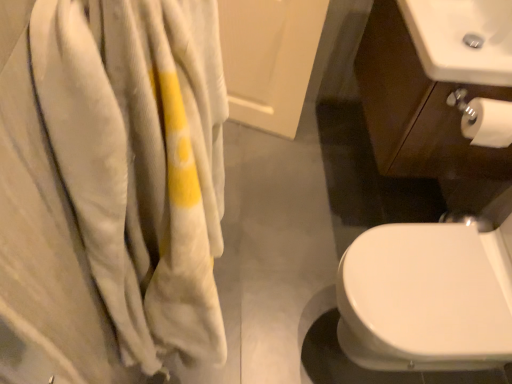
Question: Considering the relative sizes of soft white towel at left and white glossy sink at lower right, the 1th sink when ordered from front to back, in the image provided, is soft white towel at left bigger than white glossy sink at lower right, the 1th sink when ordered from front to back,?

Choices:
 (A) no
 (B) yes

Answer: (A)

Question: Does soft white towel at left contain white glossy sink at lower right, which appears as the 2th sink when viewed from the back?

Choices:
 (A) yes
 (B) no

Answer: (B)

Question: Is soft white towel at left at the left side of white glossy sink at lower right, the 2th sink when ordered from top to bottom?

Choices:
 (A) yes
 (B) no

Answer: (A)

Question: Considering the relative sizes of soft white towel at left and white glossy sink at lower right, the 1th sink when ordered from front to back, in the image provided, is soft white towel at left taller than white glossy sink at lower right, the 1th sink when ordered from front to back,?

Choices:
 (A) no
 (B) yes

Answer: (B)

Question: From a real-world perspective, does soft white towel at left stand above white glossy sink at lower right, the 2th sink when ordered from top to bottom?

Choices:
 (A) yes
 (B) no

Answer: (A)

Question: Is soft white towel at left thinner than white glossy sink at lower right, the 2th sink when ordered from top to bottom?

Choices:
 (A) no
 (B) yes

Answer: (B)

Question: Does soft white towel at left come in front of white matte toilet paper at lower right?

Choices:
 (A) no
 (B) yes

Answer: (B)

Question: Can you confirm if soft white towel at left is positioned to the left of white matte toilet paper at lower right?

Choices:
 (A) yes
 (B) no

Answer: (A)

Question: Does soft white towel at left have a lesser height compared to white matte toilet paper at lower right?

Choices:
 (A) no
 (B) yes

Answer: (A)

Question: Considering the relative sizes of soft white towel at left and white matte toilet paper at lower right in the image provided, is soft white towel at left thinner than white matte toilet paper at lower right?

Choices:
 (A) yes
 (B) no

Answer: (B)

Question: Is soft white towel at left not close to white matte toilet paper at lower right?

Choices:
 (A) yes
 (B) no

Answer: (B)

Question: Is soft white towel at left behind white matte toilet paper at lower right?

Choices:
 (A) yes
 (B) no

Answer: (B)

Question: Is white glossy sink at upper right, which is counted as the first sink, starting from the top, located outside white matte toilet paper at lower right?

Choices:
 (A) yes
 (B) no

Answer: (A)